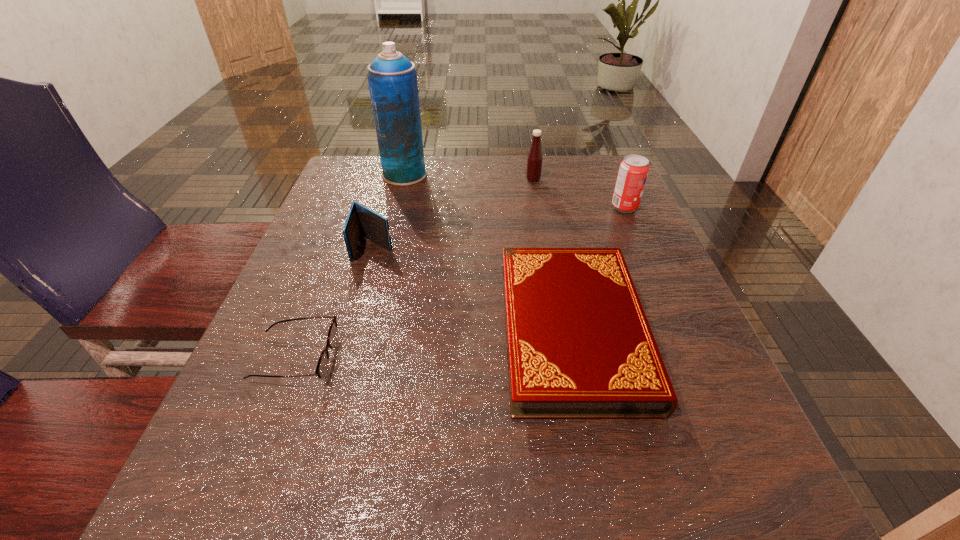
Identify the location of soda can present at the right edge. The height and width of the screenshot is (540, 960). (633, 171).

At what (x,y) coordinates should I click in order to perform the action: click on hardback book present at the right edge. Please return your answer as a coordinate pair (x, y). Looking at the image, I should click on (579, 346).

Image resolution: width=960 pixels, height=540 pixels. I want to click on object that is at the far left corner, so click(392, 78).

The image size is (960, 540). I want to click on object that is at the far right corner, so click(633, 171).

Where is `blank space at the far edge of the desktop`? The image size is (960, 540). blank space at the far edge of the desktop is located at coordinates (451, 191).

The height and width of the screenshot is (540, 960). Find the location of `vacant space at the left edge of the desktop`. vacant space at the left edge of the desktop is located at coordinates (338, 217).

Locate an element on the screen. free space at the right edge of the desktop is located at coordinates (667, 280).

Where is `vacant area at the far left corner of the desktop`? The width and height of the screenshot is (960, 540). vacant area at the far left corner of the desktop is located at coordinates (372, 183).

This screenshot has width=960, height=540. In the image, there is a desktop. What are the coordinates of `vacant region at the far right corner` in the screenshot? It's located at (595, 189).

Locate an element on the screen. This screenshot has height=540, width=960. unoccupied position between the Tabasco sauce and the spectacles is located at coordinates (414, 269).